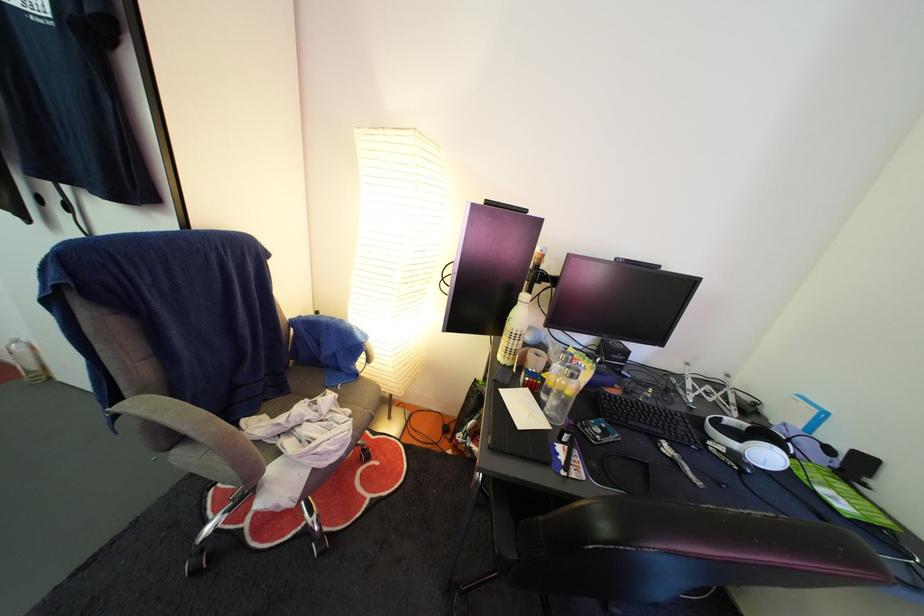
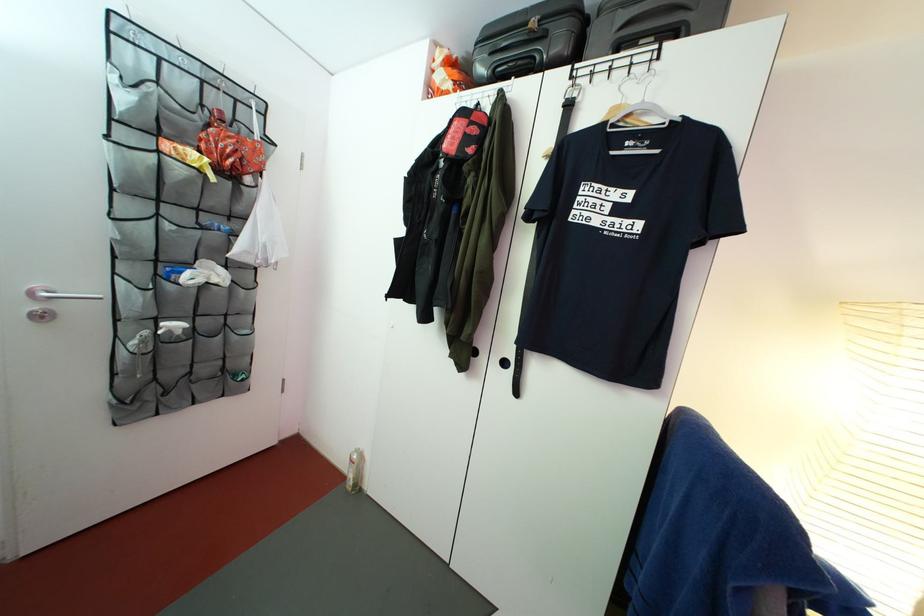
Question: The images are taken continuously from a first-person perspective. In which direction are you moving?

Choices:
 (A) Left
 (B) Right
 (C) Forward
 (D) Backward

Answer: (A)